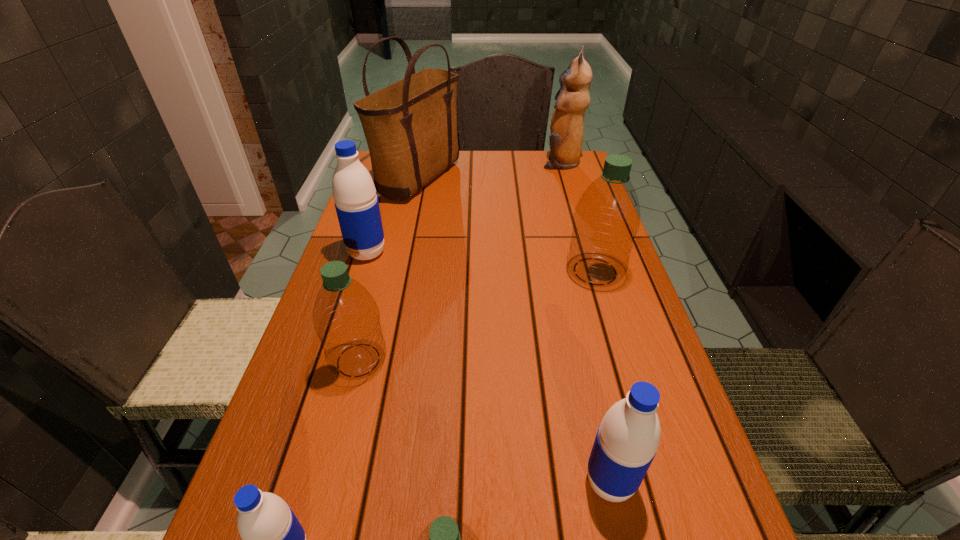
Where is `cat located in the right edge section of the desktop`? cat located in the right edge section of the desktop is located at coordinates point(567,123).

Identify the location of object that is at the far left corner. (410, 126).

The image size is (960, 540). In order to click on object that is at the far right corner in this screenshot , I will do `click(567, 123)`.

Locate an element on the screen. vacant space at the far edge of the desktop is located at coordinates (518, 153).

This screenshot has width=960, height=540. Find the location of `free space at the right edge`. free space at the right edge is located at coordinates (618, 314).

Where is `free location at the far right corner of the desktop`? The height and width of the screenshot is (540, 960). free location at the far right corner of the desktop is located at coordinates (586, 170).

The image size is (960, 540). Find the location of `free space that is in between the biggest green water bottle and the rightmost blue water bottle`. free space that is in between the biggest green water bottle and the rightmost blue water bottle is located at coordinates (603, 376).

Where is `vacant area between the second nearest green water bottle and the second nearest blue water bottle`? This screenshot has width=960, height=540. vacant area between the second nearest green water bottle and the second nearest blue water bottle is located at coordinates (484, 421).

At what (x,y) coordinates should I click in order to perform the action: click on empty space that is in between the tote bag and the biggest blue water bottle. Please return your answer as a coordinate pair (x, y). Looking at the image, I should click on (393, 217).

Identify the location of free space between the biggest blue water bottle and the tote bag. The image size is (960, 540). (393, 217).